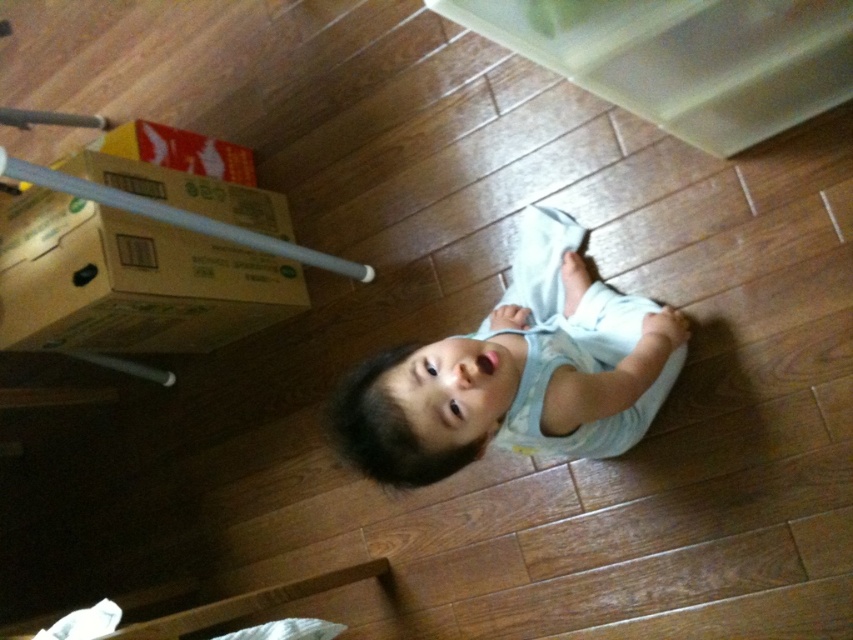
Question: Does light blue fabric at center appear on the left side of green cardboard box at left?

Choices:
 (A) no
 (B) yes

Answer: (A)

Question: Is light blue fabric at center closer to camera compared to green cardboard box at left?

Choices:
 (A) yes
 (B) no

Answer: (A)

Question: In this image, where is light blue fabric at center located relative to green cardboard box at left?

Choices:
 (A) above
 (B) below

Answer: (B)

Question: Among these points, which one is nearest to the camera?

Choices:
 (A) (518, 408)
 (B) (108, 273)

Answer: (A)